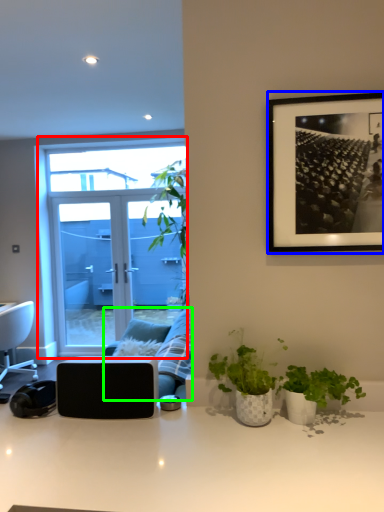
Question: Which object is positioned closest to window (highlighted by a red box)? Select from picture frame (highlighted by a blue box) and studio couch (highlighted by a green box).

Choices:
 (A) picture frame
 (B) studio couch

Answer: (B)